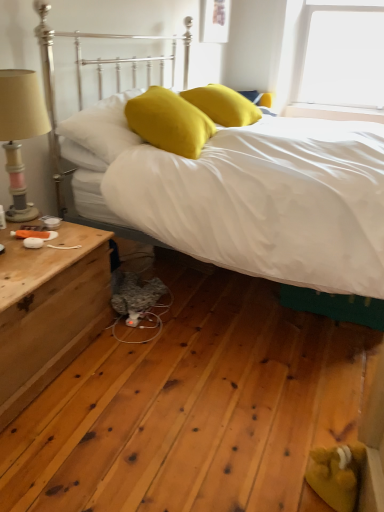
Question: From the image's perspective, is wooden nightstand at left above or below yellow matte pillow at upper left, marked as the 1th pillow in a left-to-right arrangement?

Choices:
 (A) below
 (B) above

Answer: (A)

Question: Based on their sizes in the image, would you say wooden nightstand at left is bigger or smaller than yellow matte pillow at upper left, which is counted as the 3th pillow, starting from the right?

Choices:
 (A) big
 (B) small

Answer: (A)

Question: Estimate the real-world distances between objects in this image. Which object is closer to the matte yellow pillow at center, which ranks as the third pillow in left-to-right order?

Choices:
 (A) wooden nightstand at left
 (B) yellow fabric pillow at center, the second pillow viewed from the right
 (C) wooden beige lampshade at left
 (D) yellow matte pillow at upper left, which is counted as the 3th pillow, starting from the right
 (E) white matte bed at center

Answer: (B)

Question: Which of these objects is positioned closest to the wooden nightstand at left?

Choices:
 (A) matte yellow pillow at center, the first pillow positioned from the right
 (B) yellow matte pillow at upper left, which is counted as the 3th pillow, starting from the right
 (C) yellow fabric pillow at center, the second pillow viewed from the right
 (D) white matte bed at center
 (E) wooden beige lampshade at left

Answer: (E)